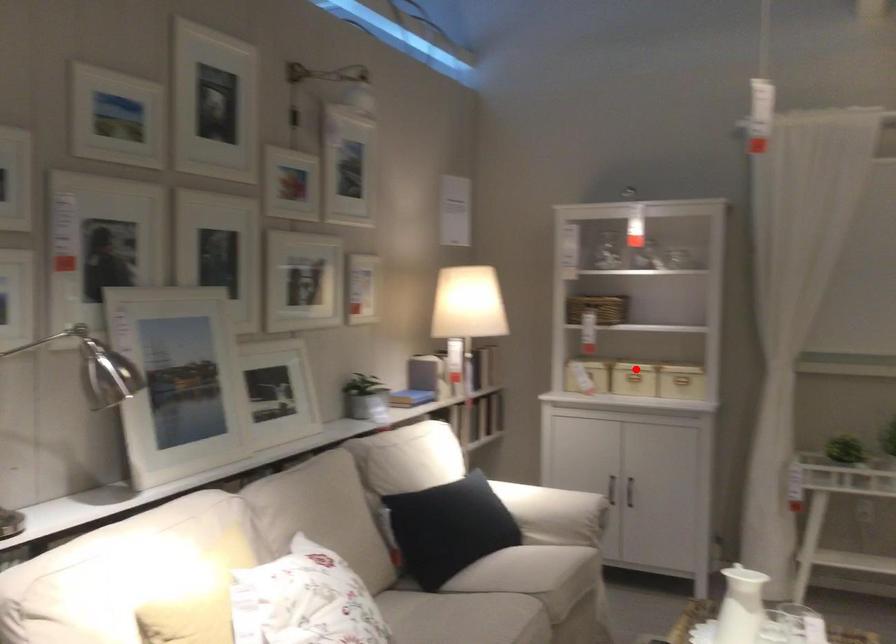
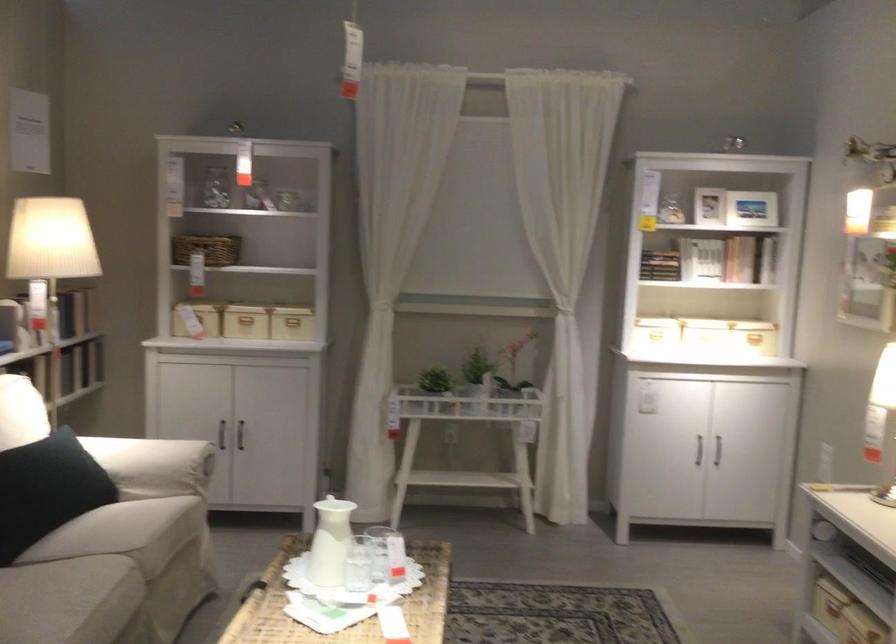
Locate, in the second image, the point that corresponds to the highlighted location in the first image.

(245, 319)